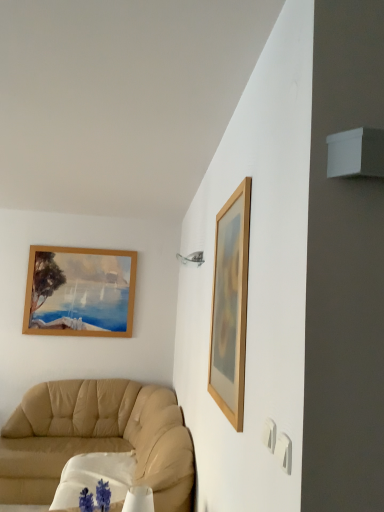
Question: From the image's perspective, is wooden picture frame at upper right over beige leather couch at lower left?

Choices:
 (A) no
 (B) yes

Answer: (B)

Question: Considering the relative sizes of wooden picture frame at upper right and beige leather couch at lower left in the image provided, is wooden picture frame at upper right wider than beige leather couch at lower left?

Choices:
 (A) yes
 (B) no

Answer: (B)

Question: Can you confirm if wooden picture frame at upper right is smaller than beige leather couch at lower left?

Choices:
 (A) no
 (B) yes

Answer: (B)

Question: Considering the relative positions of wooden picture frame at upper right and beige leather couch at lower left in the image provided, is wooden picture frame at upper right behind beige leather couch at lower left?

Choices:
 (A) no
 (B) yes

Answer: (A)

Question: Is wooden picture frame at upper right to the right of beige leather couch at lower left from the viewer's perspective?

Choices:
 (A) no
 (B) yes

Answer: (B)

Question: From a real-world perspective, is white fabric round table at lower left positioned above or below wooden picture frame at upper right?

Choices:
 (A) below
 (B) above

Answer: (A)

Question: In the image, is white fabric round table at lower left positioned in front of or behind wooden picture frame at upper right?

Choices:
 (A) behind
 (B) front

Answer: (A)

Question: From their relative heights in the image, would you say white fabric round table at lower left is taller or shorter than wooden picture frame at upper right?

Choices:
 (A) tall
 (B) short

Answer: (B)

Question: Is white fabric round table at lower left spatially inside wooden picture frame at upper right, or outside of it?

Choices:
 (A) inside
 (B) outside

Answer: (B)

Question: Considering their positions, is beige leather couch at lower left located in front of or behind white fabric round table at lower left?

Choices:
 (A) front
 (B) behind

Answer: (A)

Question: Is beige leather couch at lower left inside the boundaries of white fabric round table at lower left, or outside?

Choices:
 (A) outside
 (B) inside

Answer: (A)

Question: In terms of height, does beige leather couch at lower left look taller or shorter compared to white fabric round table at lower left?

Choices:
 (A) short
 (B) tall

Answer: (B)

Question: From the image's perspective, relative to white fabric round table at lower left, is beige leather couch at lower left above or below?

Choices:
 (A) below
 (B) above

Answer: (B)

Question: Looking at their shapes, would you say white fabric round table at lower left is wider or thinner than beige leather couch at lower left?

Choices:
 (A) thin
 (B) wide

Answer: (A)

Question: Choose the correct answer: Is white fabric round table at lower left inside beige leather couch at lower left or outside it?

Choices:
 (A) outside
 (B) inside

Answer: (B)